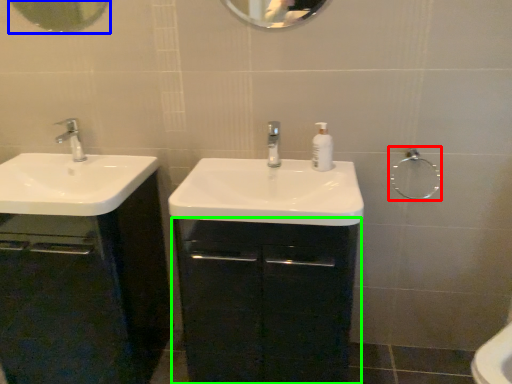
Question: Based on their relative distances, which object is farther from shower (highlighted by a red box)? Choose from mirror (highlighted by a blue box) and bathroom cabinet (highlighted by a green box).

Choices:
 (A) mirror
 (B) bathroom cabinet

Answer: (A)